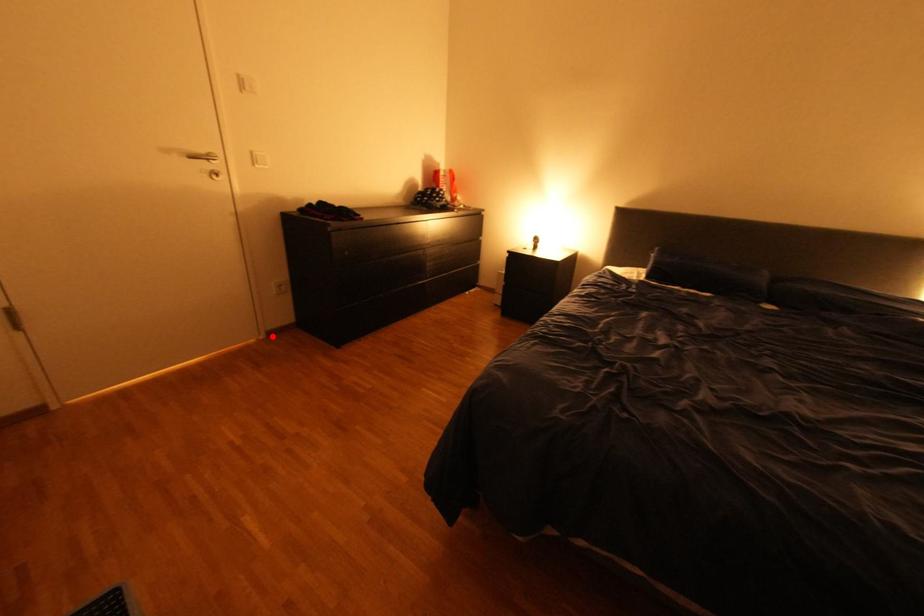
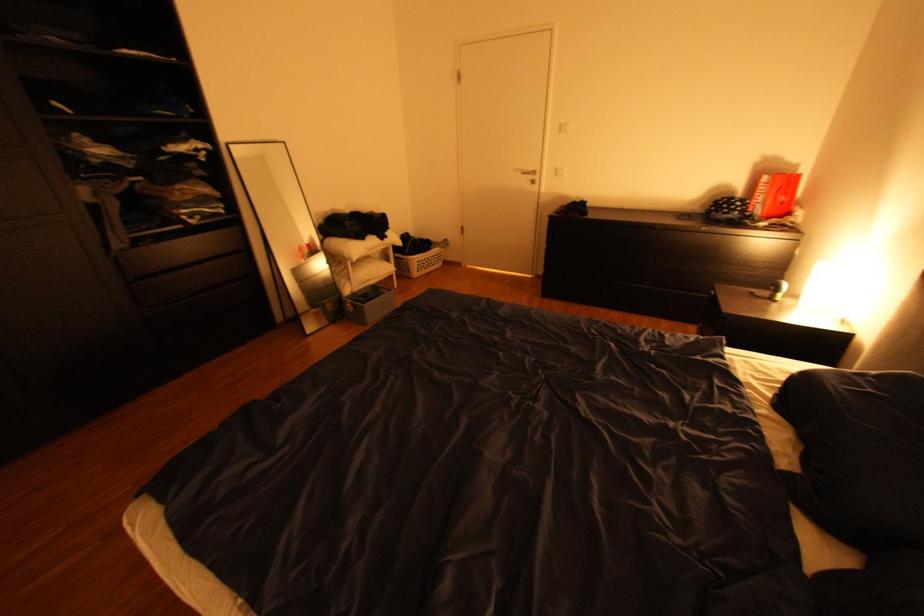
Question: I am providing you with two images of the same scene from different viewpoints. In image1, a red point is highlighted. Considering the same 3D point in image2, which of the following is correct?

Choices:
 (A) It is closer
 (B) It is farther

Answer: (A)